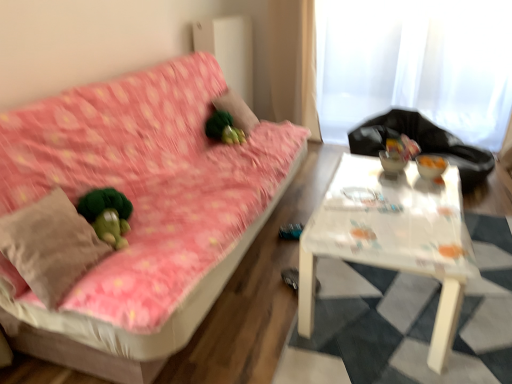
Question: Considering the relative positions of pink floral fabric couch at left and green fuzzy ball at center in the image provided, is pink floral fabric couch at left to the left of green fuzzy ball at center from the viewer's perspective?

Choices:
 (A) yes
 (B) no

Answer: (A)

Question: Considering the relative sizes of pink floral fabric couch at left and green fuzzy ball at center in the image provided, is pink floral fabric couch at left taller than green fuzzy ball at center?

Choices:
 (A) no
 (B) yes

Answer: (B)

Question: Is pink floral fabric couch at left positioned with its back to green fuzzy ball at center?

Choices:
 (A) yes
 (B) no

Answer: (A)

Question: From a real-world perspective, is pink floral fabric couch at left below green fuzzy ball at center?

Choices:
 (A) yes
 (B) no

Answer: (A)

Question: From the image's perspective, does pink floral fabric couch at left appear higher than green fuzzy ball at center?

Choices:
 (A) yes
 (B) no

Answer: (B)

Question: Is pink floral fabric couch at left directly adjacent to green fuzzy ball at center?

Choices:
 (A) no
 (B) yes

Answer: (A)

Question: Can you confirm if pink floral fabric couch at left is bigger than black plastic bag at upper right?

Choices:
 (A) yes
 (B) no

Answer: (A)

Question: Can you confirm if pink floral fabric couch at left is wider than black plastic bag at upper right?

Choices:
 (A) yes
 (B) no

Answer: (B)

Question: Does pink floral fabric couch at left appear on the right side of black plastic bag at upper right?

Choices:
 (A) no
 (B) yes

Answer: (A)

Question: Can you confirm if pink floral fabric couch at left is shorter than black plastic bag at upper right?

Choices:
 (A) no
 (B) yes

Answer: (A)

Question: Considering the relative positions of pink floral fabric couch at left and black plastic bag at upper right in the image provided, is pink floral fabric couch at left behind black plastic bag at upper right?

Choices:
 (A) yes
 (B) no

Answer: (B)

Question: Can you confirm if pink floral fabric couch at left is positioned to the left of black plastic bag at upper right?

Choices:
 (A) yes
 (B) no

Answer: (A)

Question: Is white sheer curtain at upper right inside beige cotton throw pillow at left?

Choices:
 (A) no
 (B) yes

Answer: (A)